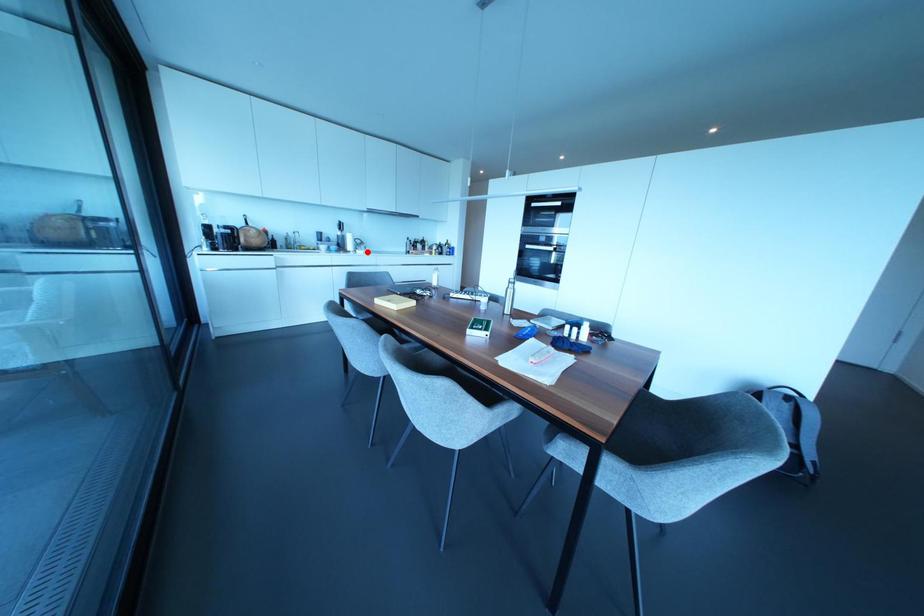
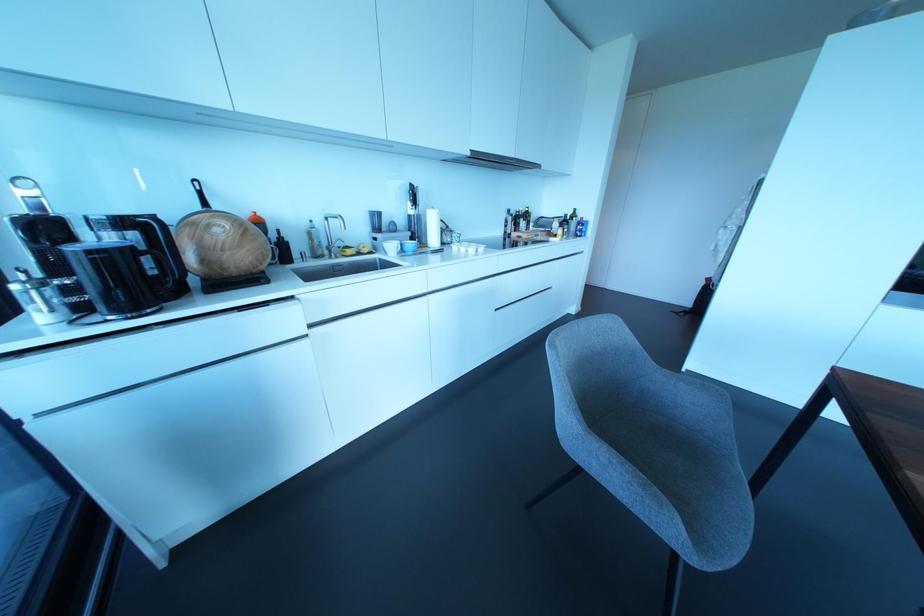
Where in the second image is the point corresponding to the highlighted location from the first image?

(480, 249)